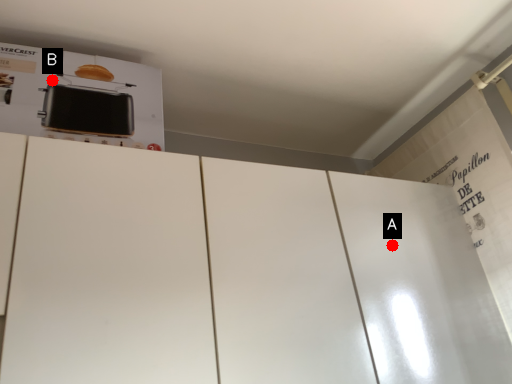
Question: Two points are circled on the image, labeled by A and B beside each circle. Which point is closer to the camera taking this photo?

Choices:
 (A) A is closer
 (B) B is closer

Answer: (B)